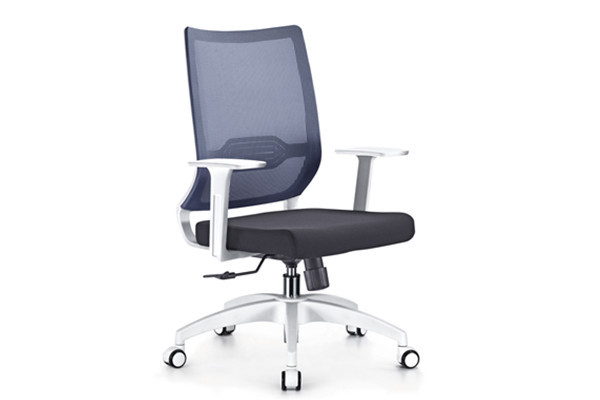
You are a GUI agent. You are given a task and a screenshot of the screen. Output one action in this format:
    pyautogui.click(x=<x>, y=<y>)
    Task: Click on the silver chair legs
    The width and height of the screenshot is (600, 400).
    Given the screenshot: What is the action you would take?
    pyautogui.click(x=307, y=310), pyautogui.click(x=274, y=312), pyautogui.click(x=260, y=296), pyautogui.click(x=335, y=299), pyautogui.click(x=287, y=334)